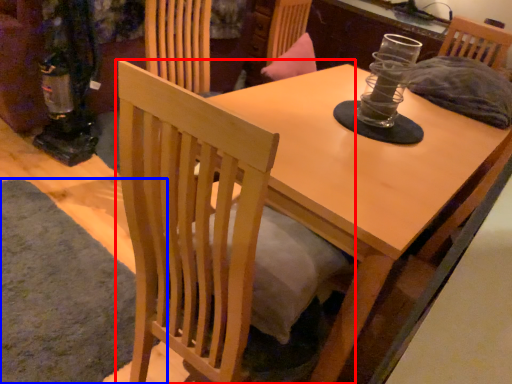
Question: Which of the following is the closest to the observer, chair (highlighted by a red box) or mat (highlighted by a blue box)?

Choices:
 (A) chair
 (B) mat

Answer: (A)